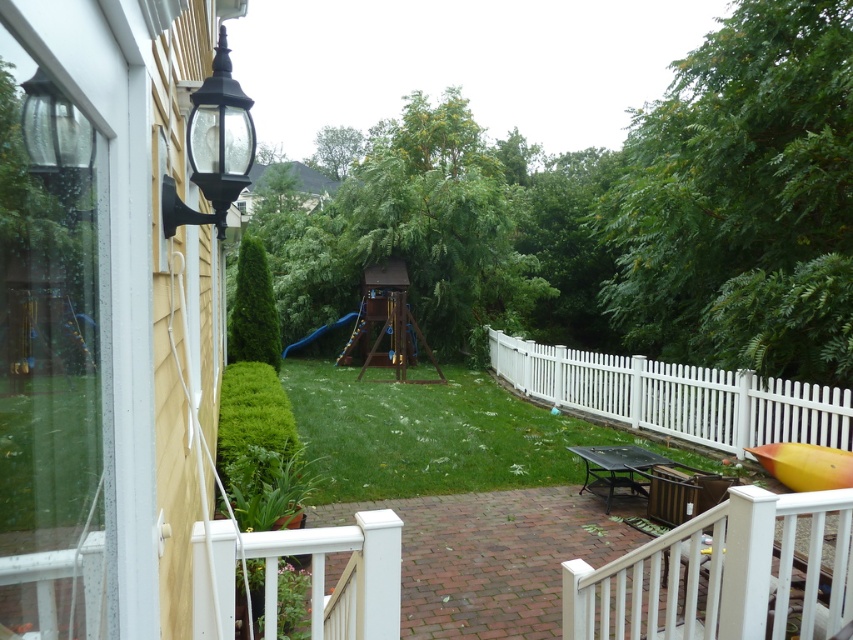
Who is taller, white painted wood porch at lower center or blue rubber slide at center?

Standing taller between the two is white painted wood porch at lower center.

You are a GUI agent. You are given a task and a screenshot of the screen. Output one action in this format:
    pyautogui.click(x=<x>, y=<y>)
    Task: Click on the white painted wood porch at lower center
    The image size is (853, 640).
    Given the screenshot: What is the action you would take?
    pyautogui.click(x=718, y=573)

Can you confirm if white picket fence at lower right is bigger than blue rubber slide at center?

No.

Does white picket fence at lower right appear on the right side of blue rubber slide at center?

Indeed, white picket fence at lower right is positioned on the right side of blue rubber slide at center.

Find the location of a particular element. This screenshot has width=853, height=640. white picket fence at lower right is located at coordinates (676, 396).

Between green grass at center and blue rubber slide at center, which one has less height?

green grass at center is shorter.

Does green grass at center have a lesser height compared to blue rubber slide at center?

Indeed, green grass at center has a lesser height compared to blue rubber slide at center.

Where is `green grass at center`? Image resolution: width=853 pixels, height=640 pixels. green grass at center is located at coordinates (438, 435).